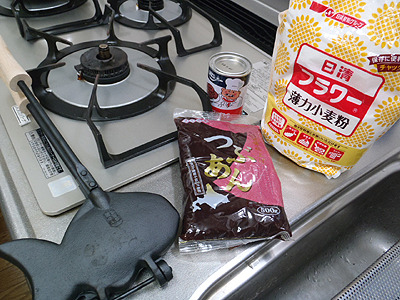
Identify the location of appliance label. The width and height of the screenshot is (400, 300). tap(41, 146), tap(261, 82).